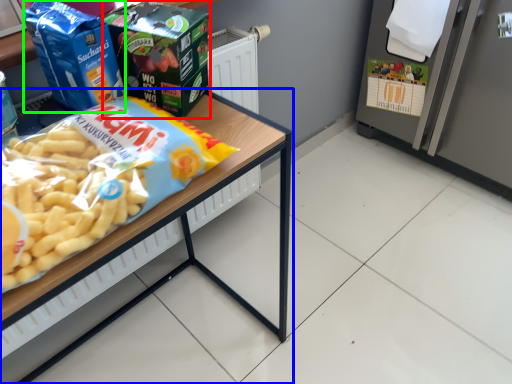
Question: Based on their relative distances, which object is nearer to product (highlighted by a red box)? Choose from table (highlighted by a blue box) and product (highlighted by a green box).

Choices:
 (A) table
 (B) product

Answer: (B)